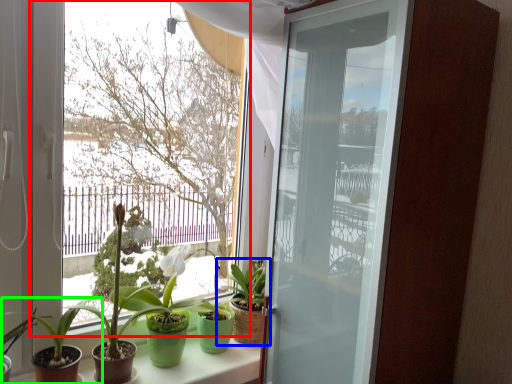
Question: Which is nearer to the window (highlighted by a red box)? houseplant (highlighted by a blue box) or houseplant (highlighted by a green box).

Choices:
 (A) houseplant
 (B) houseplant

Answer: (A)